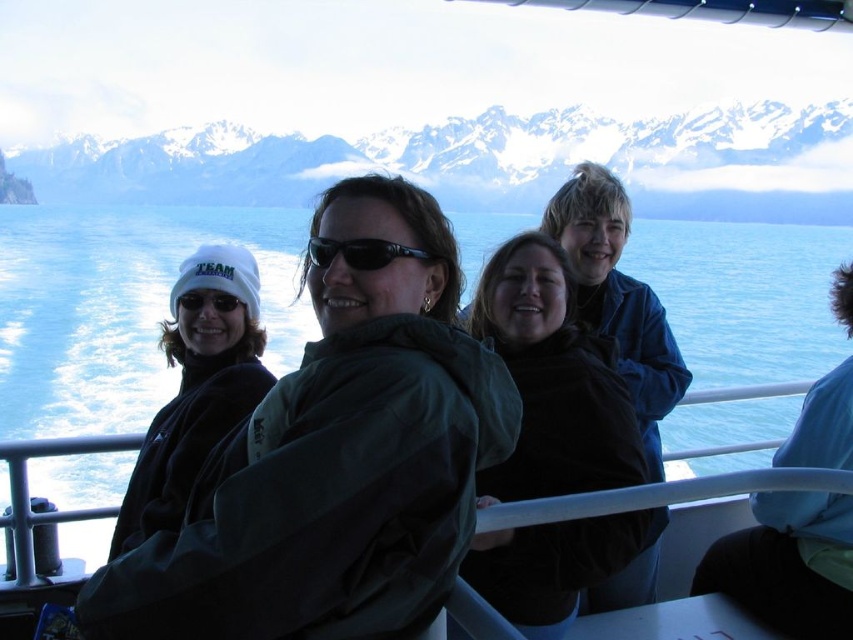
Measure the distance between snowy mountain range at upper center and camera.

A distance of 218.92 meters exists between snowy mountain range at upper center and camera.

What do you see at coordinates (491, 161) in the screenshot?
I see `snowy mountain range at upper center` at bounding box center [491, 161].

Identify the location of snowy mountain range at upper center. (491, 161).

You are a GUI agent. You are given a task and a screenshot of the screen. Output one action in this format:
    pyautogui.click(x=<x>, y=<y>)
    Task: Click on the snowy mountain range at upper center
    This screenshot has width=853, height=640.
    Given the screenshot: What is the action you would take?
    pyautogui.click(x=491, y=161)

Between snowy mountain range at upper center and black plastic sunglasses at center, which one is positioned higher?

Positioned higher is snowy mountain range at upper center.

Who is more forward, (630, 152) or (416, 257)?

Point (416, 257) is in front.

Where is `snowy mountain range at upper center`? This screenshot has width=853, height=640. snowy mountain range at upper center is located at coordinates (491, 161).

In the scene shown: Between green matte jacket at center and matte black goggles at center, which one has more height?

With more height is green matte jacket at center.

Does green matte jacket at center appear on the right side of matte black goggles at center?

Yes, green matte jacket at center is to the right of matte black goggles at center.

The image size is (853, 640). What are the coordinates of `green matte jacket at center` in the screenshot? It's located at (335, 460).